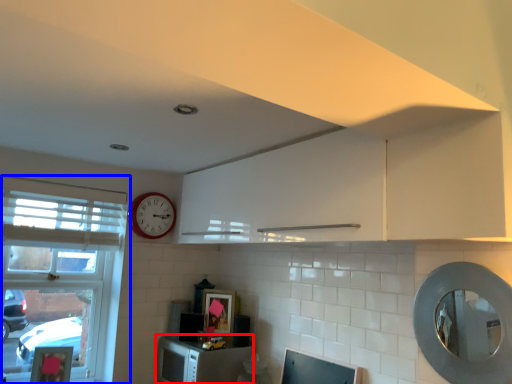
Question: Which point is closer to the camera, cabinetry (highlighted by a red box) or window (highlighted by a blue box)?

Choices:
 (A) cabinetry
 (B) window

Answer: (B)